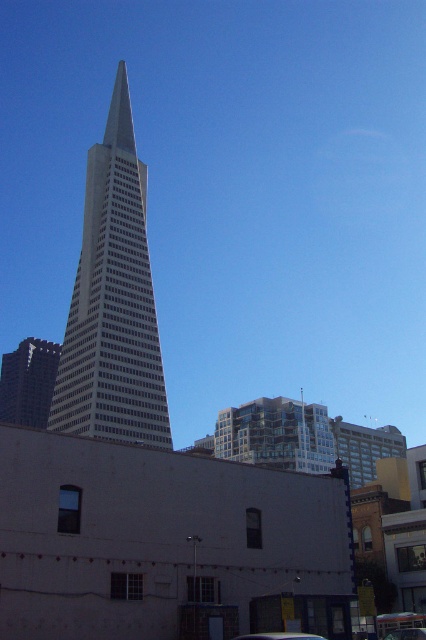
You are a photographer trying to capture the glassy steel skyscraper at center and the metallic silver car at center in a single frame. Given that the skyscraper is much larger than the car, how might you position your camera to emphasize the size difference between them?

Position the camera closer to the metallic silver car at center so that it appears larger in the frame relative to the glassy steel skyscraper at center, thereby emphasizing the size difference between them.

You are a photographer standing at the base of the glassy steel skyscraper at center. You want to capture a photo of the metallic silver car at lower center without the skyscraper blocking it. Is this possible given their sizes?

The glassy steel skyscraper at center is larger in size than the metallic silver car at lower center. Since the skyscraper is larger and positioned at the center, it would likely block the view of the metallic silver car at lower center. Therefore, capturing the car without the skyscraper blocking it might not be possible from your current position.